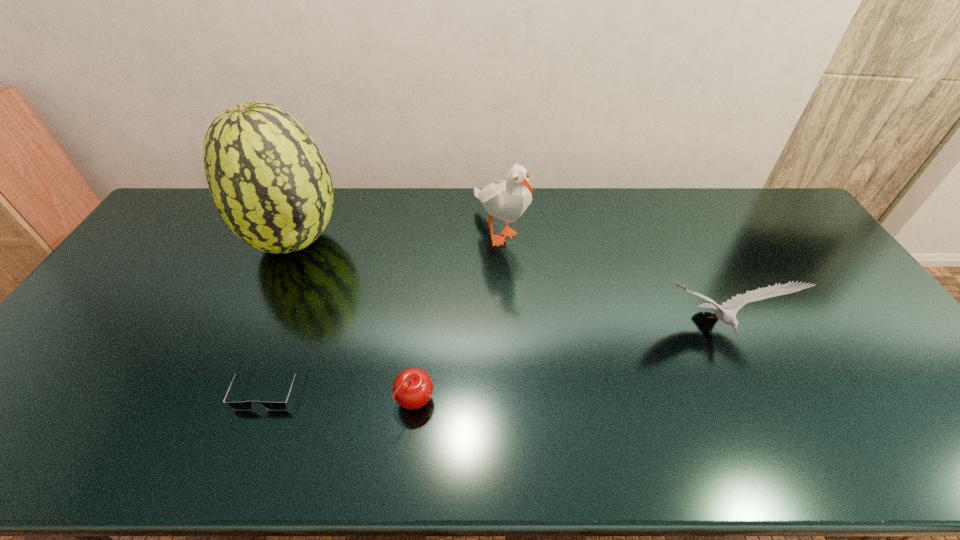
Find the location of a particular element. The image size is (960, 540). vacant position located 0.230m at the tip of the beak of the rightmost object is located at coordinates (764, 434).

I want to click on free space located on the back of the third object from right to left, so click(x=420, y=355).

Find the location of `free region located on the front-facing side of the shortest object`. free region located on the front-facing side of the shortest object is located at coordinates (249, 440).

This screenshot has width=960, height=540. What are the coordinates of `watermelon that is at the far edge` in the screenshot? It's located at (269, 181).

I want to click on gull positioned at the far edge, so click(x=507, y=200).

You are a GUI agent. You are given a task and a screenshot of the screen. Output one action in this format:
    pyautogui.click(x=<x>, y=<y>)
    Task: Click on the free space at the far edge
    
    Given the screenshot: What is the action you would take?
    pyautogui.click(x=660, y=221)

This screenshot has width=960, height=540. Find the location of `free location at the near edge`. free location at the near edge is located at coordinates (714, 438).

The height and width of the screenshot is (540, 960). Find the location of `vacant space at the left edge of the desktop`. vacant space at the left edge of the desktop is located at coordinates (48, 406).

In the image, there is a desktop. Where is `vacant space at the right edge`? This screenshot has width=960, height=540. vacant space at the right edge is located at coordinates (866, 306).

You are a GUI agent. You are given a task and a screenshot of the screen. Output one action in this format:
    pyautogui.click(x=<x>, y=<y>)
    Task: Click on the unoccupied position between the second shortest object and the farther gull
    Image resolution: width=960 pixels, height=540 pixels.
    Given the screenshot: What is the action you would take?
    pyautogui.click(x=458, y=316)